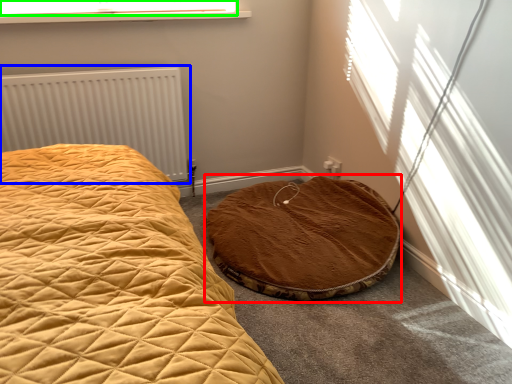
Question: Which object is the closest to the cat bed (highlighted by a red box)? Choose among these: radiator (highlighted by a blue box) or window screen (highlighted by a green box).

Choices:
 (A) radiator
 (B) window screen

Answer: (A)